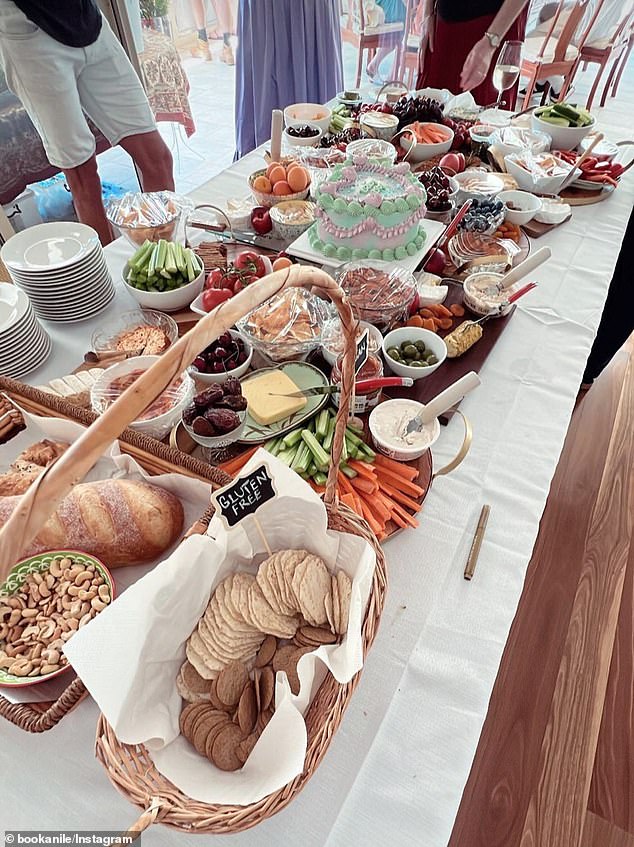
The width and height of the screenshot is (634, 847). I want to click on cloth table, so click(70, 761).